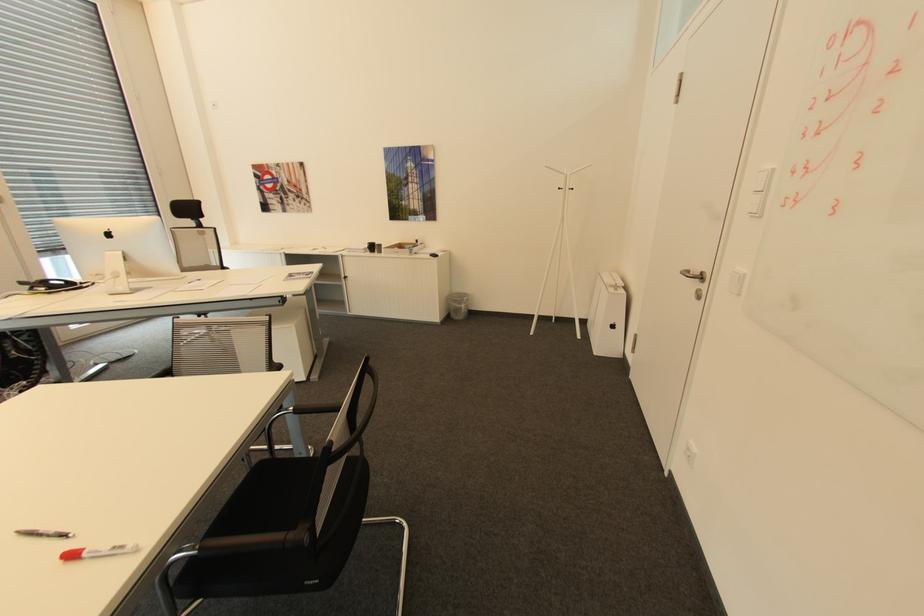
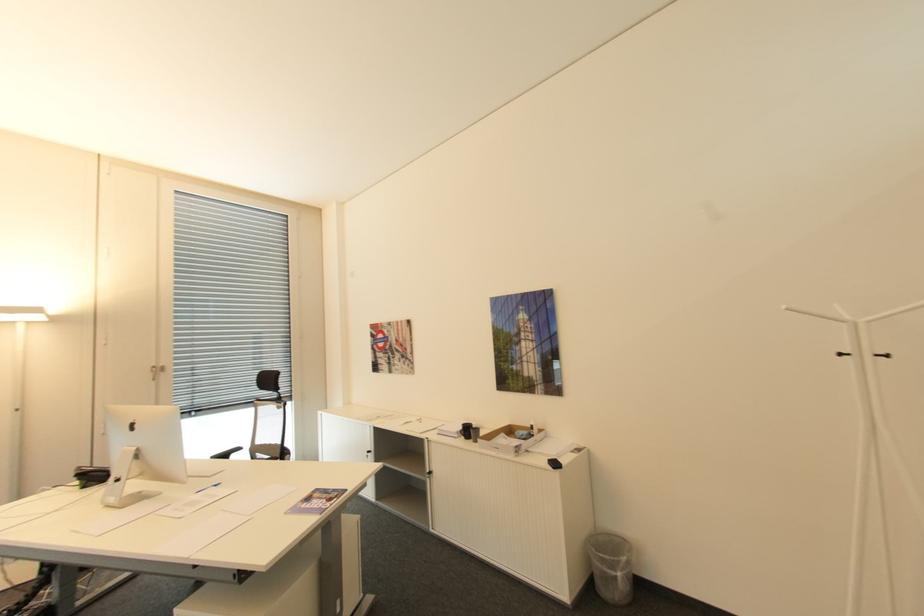
Find the pixel in the second image that matches point (465, 305) in the first image.

(617, 570)